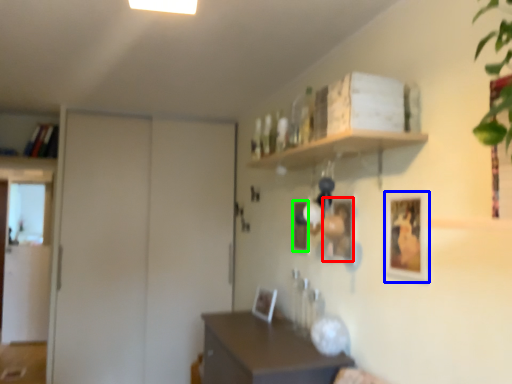
Question: Considering the real-world distances, which object is closest to picture frame (highlighted by a red box)? picture frame (highlighted by a blue box) or picture frame (highlighted by a green box).

Choices:
 (A) picture frame
 (B) picture frame

Answer: (A)